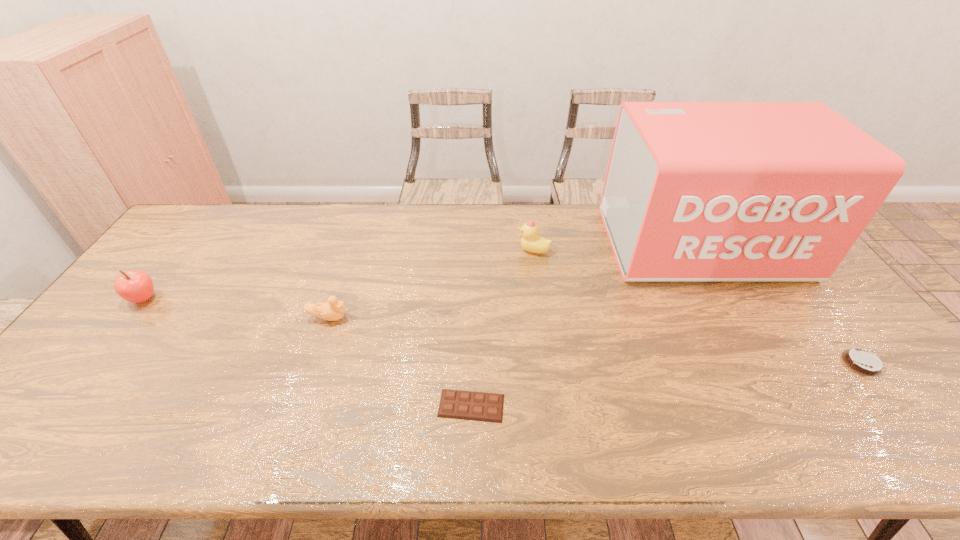
Find the location of a particular element. Image resolution: width=960 pixels, height=540 pixels. duckling that is at the far edge is located at coordinates (531, 241).

Where is `object at the near edge`? object at the near edge is located at coordinates (467, 405).

You are a GUI agent. You are given a task and a screenshot of the screen. Output one action in this format:
    pyautogui.click(x=<x>, y=<y>)
    Task: Click on the object positioned at the left edge
    This screenshot has width=960, height=540.
    Given the screenshot: What is the action you would take?
    pyautogui.click(x=135, y=286)

At what (x,y) coordinates should I click in order to perform the action: click on box present at the right edge. Please return your answer as a coordinate pair (x, y). Image resolution: width=960 pixels, height=540 pixels. Looking at the image, I should click on (x=694, y=191).

Where is `chocolate cake that is positioned at the right edge`? Image resolution: width=960 pixels, height=540 pixels. chocolate cake that is positioned at the right edge is located at coordinates (863, 362).

Locate an element on the screen. The height and width of the screenshot is (540, 960). object present at the far right corner is located at coordinates (694, 191).

I want to click on vacant space at the far edge of the desktop, so click(320, 217).

This screenshot has height=540, width=960. Find the location of `vacant point at the near edge`. vacant point at the near edge is located at coordinates [x=764, y=421].

Identify the location of blank space at the left edge of the desktop. This screenshot has height=540, width=960. (134, 314).

Locate an element on the screen. free space at the right edge of the desktop is located at coordinates (859, 335).